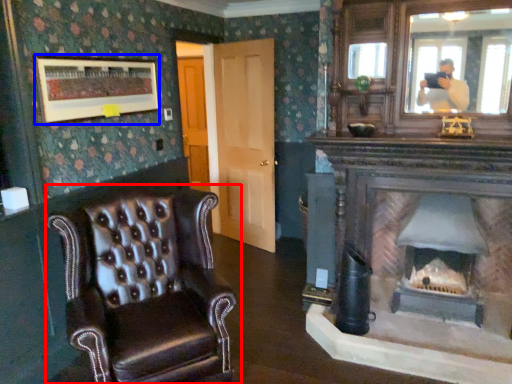
Question: Which object appears closest to the camera in this image, chair (highlighted by a red box) or picture frame (highlighted by a blue box)?

Choices:
 (A) chair
 (B) picture frame

Answer: (A)